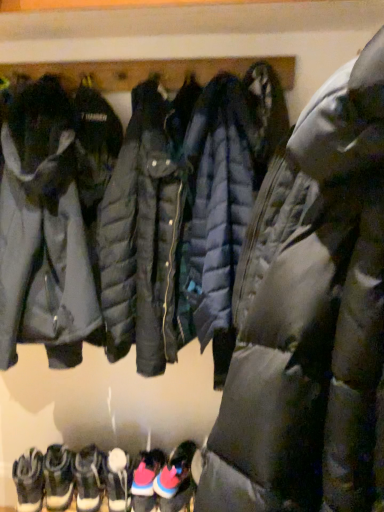
Question: Considering the positions of white leather sneakers at lower left, which ranks as the 3th footwear in left-to-right order, and pink suede sneakers at lower center, the sixth footwear from the left, in the image, is white leather sneakers at lower left, which ranks as the 3th footwear in left-to-right order, wider or thinner than pink suede sneakers at lower center, the sixth footwear from the left,?

Choices:
 (A) wide
 (B) thin

Answer: (B)

Question: From the image's perspective, relative to pink suede sneakers at lower center, the sixth footwear from the left, is white leather sneakers at lower left, arranged as the 4th footwear when viewed from the right, above or below?

Choices:
 (A) above
 (B) below

Answer: (A)

Question: Estimate the real-world distances between objects in this image. Which object is closer to the pink suede sneakers at lower center, which appears as the 1th footwear when viewed from the right?

Choices:
 (A) matte black puffer jacket at center, which ranks as the second jacket in left-to-right order
 (B) white suede boots at lower left, the fifth footwear when ordered from right to left
 (C) matte black puffer jacket at center
 (D) white suede boot at lower center, positioned as the fourth footwear in left-to-right order
 (E) white leather sneakers at lower left, which ranks as the 3th footwear in left-to-right order

Answer: (D)

Question: Estimate the real-world distances between objects in this image. Which object is closer to the matte black puffer jacket at center?

Choices:
 (A) white suede boots at lower left, the 2th footwear in the left-to-right sequence
 (B) matte black puffer jacket at center, which appears as the first jacket when viewed from the right
 (C) pink suede sneakers at lower center, the second footwear viewed from the right
 (D) pink suede sneakers at lower center, the sixth footwear from the left
 (E) white leather sneakers at lower left, which ranks as the 3th footwear in left-to-right order

Answer: (B)